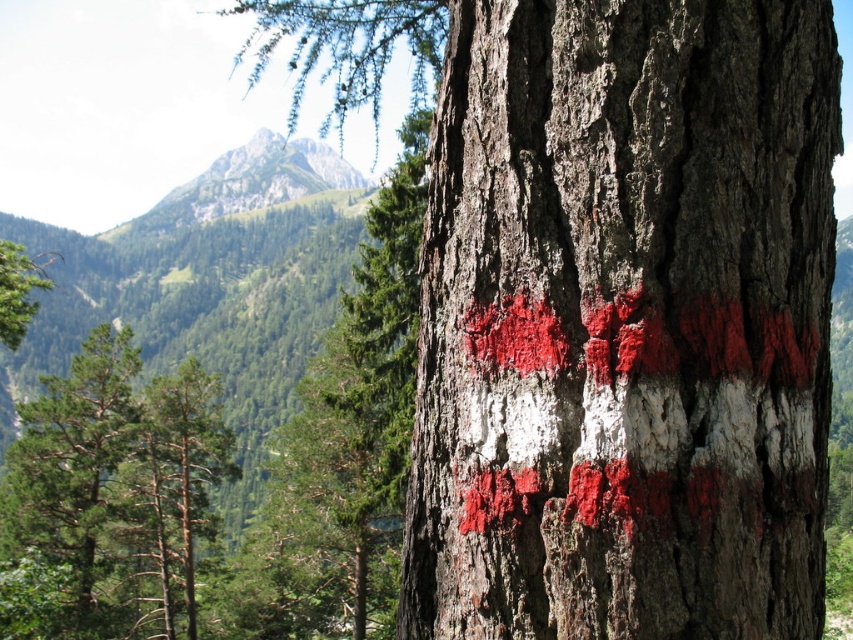
Does smooth bark tree trunk at center have a lesser width compared to green grassy mountain at upper center?

Correct, smooth bark tree trunk at center's width is less than green grassy mountain at upper center's.

At what (x,y) coordinates should I click in order to perform the action: click on smooth bark tree trunk at center. Please return your answer as a coordinate pair (x, y). Looking at the image, I should click on (625, 323).

Between point (643, 579) and point (132, 424), which one is positioned in front?

Point (643, 579) is more forward.

Which is behind, point (769, 348) or point (33, 515)?

The point (33, 515) is behind.

Image resolution: width=853 pixels, height=640 pixels. I want to click on smooth bark tree trunk at center, so click(x=625, y=323).

Identify the location of green rough bark tree at left. This screenshot has width=853, height=640. (67, 493).

Which is more to the left, green rough bark tree at left or green grassy mountain at upper center?

From the viewer's perspective, green grassy mountain at upper center appears more on the left side.

Is point (16, 476) positioned behind point (202, 212)?

No, it is in front of (202, 212).

Image resolution: width=853 pixels, height=640 pixels. I want to click on green rough bark tree at left, so click(x=67, y=493).